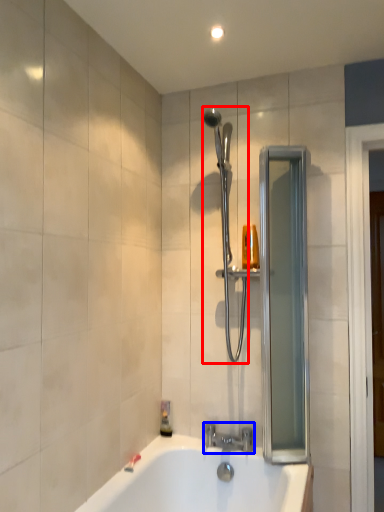
Question: Which point is further to the camera, shower (highlighted by a red box) or tap (highlighted by a blue box)?

Choices:
 (A) shower
 (B) tap

Answer: (B)